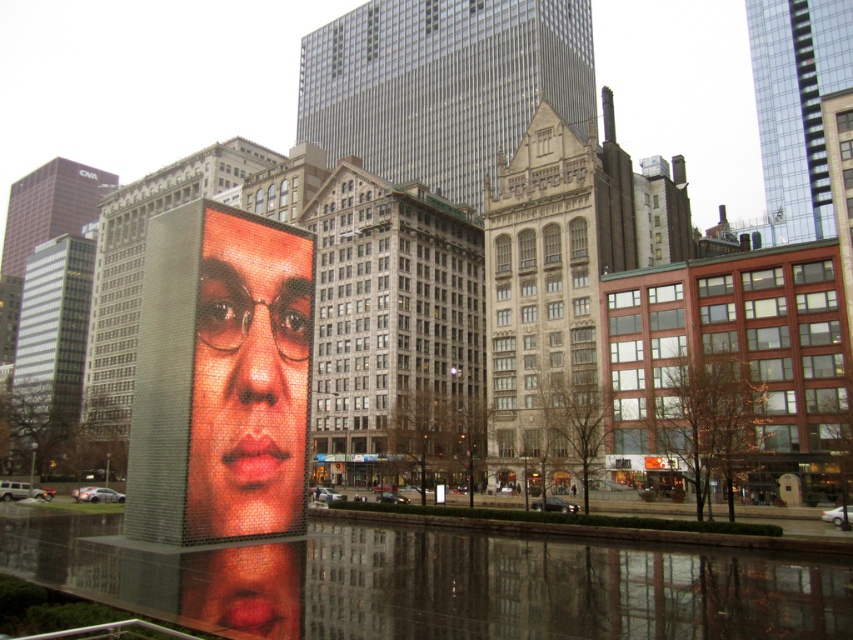
Question: Can you confirm if reflective glass water at center is thinner than polished mosaic face at center?

Choices:
 (A) no
 (B) yes

Answer: (A)

Question: Which point is closer to the camera?

Choices:
 (A) reflective glass water at center
 (B) polished mosaic face at center

Answer: (A)

Question: Can you confirm if reflective glass water at center is wider than polished mosaic face at center?

Choices:
 (A) yes
 (B) no

Answer: (A)

Question: Which of the following is the farthest from the observer?

Choices:
 (A) reflective glass water at center
 (B) polished mosaic face at center

Answer: (B)

Question: From the image, what is the correct spatial relationship of reflective glass water at center in relation to polished mosaic face at center?

Choices:
 (A) left
 (B) right

Answer: (B)